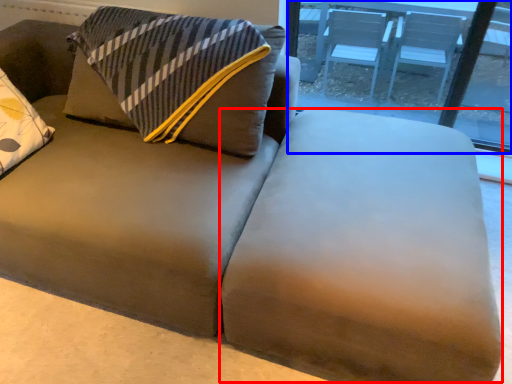
Question: Among these objects, which one is farthest to the camera, flat (highlighted by a red box) or window (highlighted by a blue box)?

Choices:
 (A) flat
 (B) window

Answer: (B)